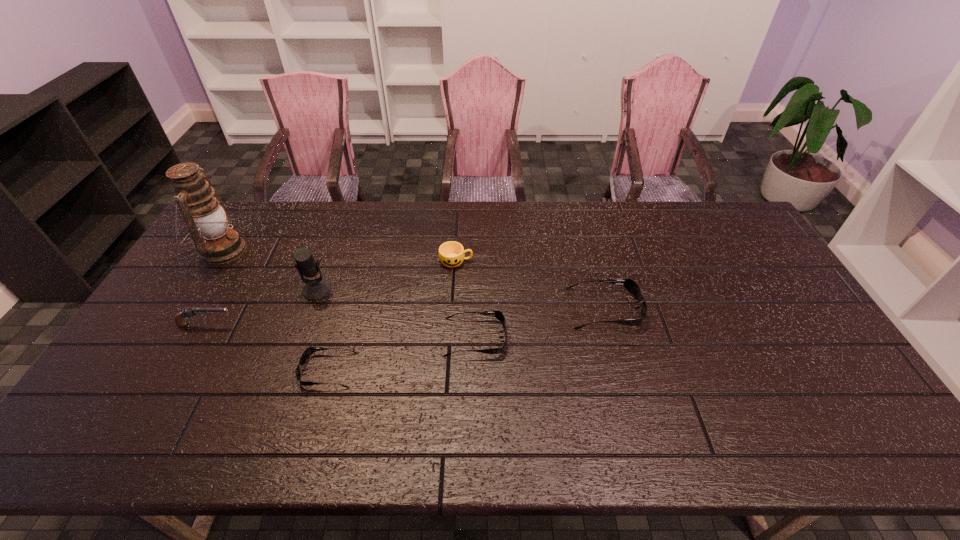
Locate an element on the screen. object that is at the near edge is located at coordinates (309, 351).

This screenshot has height=540, width=960. What are the coordinates of `gun situated at the left edge` in the screenshot? It's located at (187, 311).

Locate an element on the screen. The image size is (960, 540). lantern that is positioned at the left edge is located at coordinates (208, 220).

I want to click on object located in the far left corner section of the desktop, so click(x=208, y=220).

Locate an element on the screen. The image size is (960, 540). vacant space at the far edge is located at coordinates (425, 202).

Locate an element on the screen. Image resolution: width=960 pixels, height=540 pixels. free space at the near edge of the desktop is located at coordinates (376, 411).

Where is `vacant region at the right edge of the desktop`? vacant region at the right edge of the desktop is located at coordinates (823, 357).

The width and height of the screenshot is (960, 540). Identify the location of vacant space at the far left corner of the desktop. click(251, 215).

What are the coordinates of `free space at the near left corner of the desktop` in the screenshot? It's located at (101, 392).

Locate an element on the screen. This screenshot has height=540, width=960. empty space that is in between the gun and the shortest sunglasses is located at coordinates (267, 347).